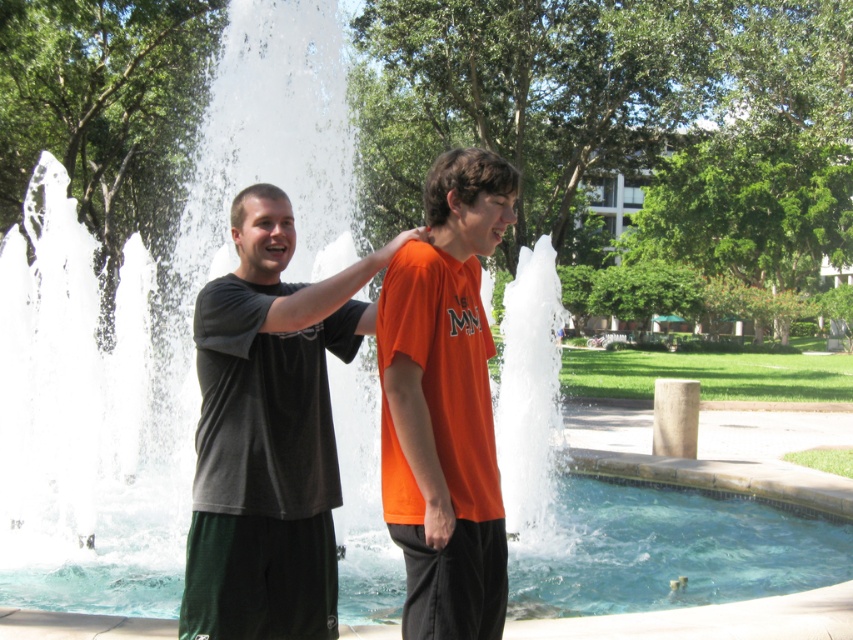
Question: Is dark gray t-shirt at center to the left of orange matte shirt at center from the viewer's perspective?

Choices:
 (A) no
 (B) yes

Answer: (B)

Question: Considering the relative positions of dark gray t-shirt at center and orange matte shirt at center in the image provided, where is dark gray t-shirt at center located with respect to orange matte shirt at center?

Choices:
 (A) right
 (B) left

Answer: (B)

Question: Does dark gray t-shirt at center appear over orange matte shirt at center?

Choices:
 (A) yes
 (B) no

Answer: (B)